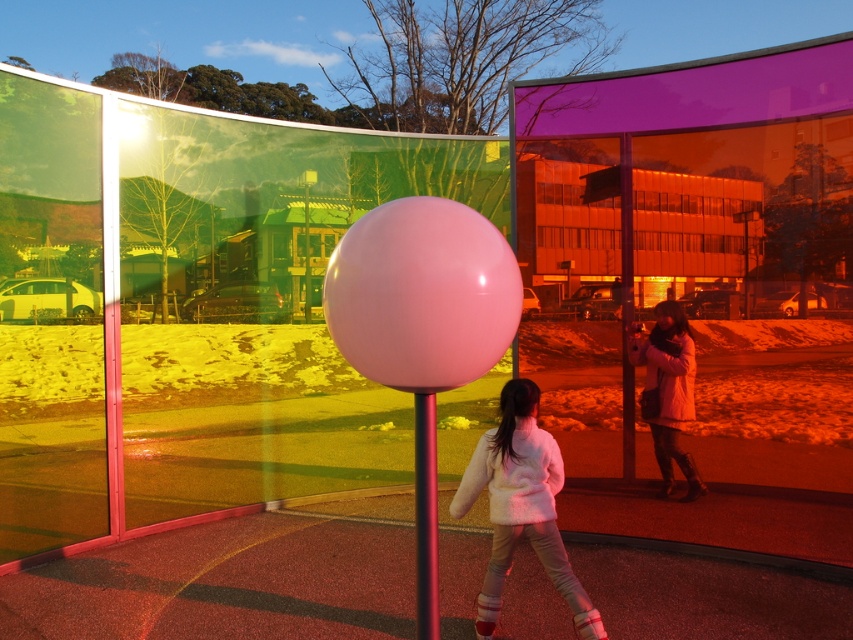
Who is positioned more to the right, glossy pink balloon at center or glossy plastic pole at center?

glossy plastic pole at center is more to the right.

Does glossy pink balloon at center have a lesser width compared to glossy plastic pole at center?

No, glossy pink balloon at center is not thinner than glossy plastic pole at center.

Identify the location of glossy pink balloon at center. This screenshot has height=640, width=853. (422, 294).

Find the location of a particular element. glossy pink balloon at center is located at coordinates (422, 294).

Which is above, matte pink coat at right or glossy plastic pole at center?

glossy plastic pole at center

This screenshot has height=640, width=853. What do you see at coordinates (668, 392) in the screenshot?
I see `matte pink coat at right` at bounding box center [668, 392].

Locate an element on the screen. matte pink coat at right is located at coordinates (668, 392).

Based on the photo, who is positioned more to the right, white fluffy coat at center or matte pink coat at right?

matte pink coat at right is more to the right.

Is white fluffy coat at center shorter than matte pink coat at right?

Yes, white fluffy coat at center is shorter than matte pink coat at right.

This screenshot has width=853, height=640. Describe the element at coordinates (521, 506) in the screenshot. I see `white fluffy coat at center` at that location.

This screenshot has height=640, width=853. In order to click on white fluffy coat at center in this screenshot , I will do `click(521, 506)`.